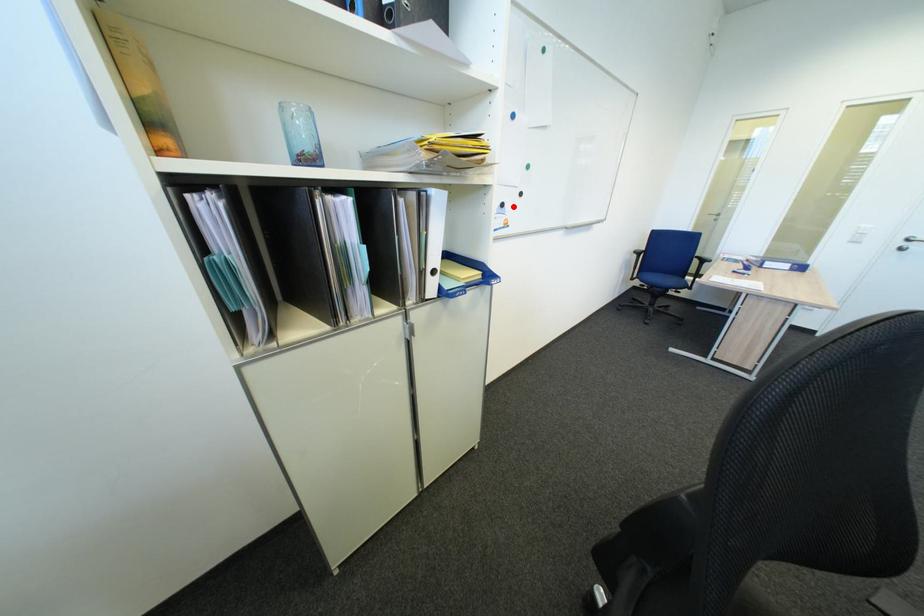
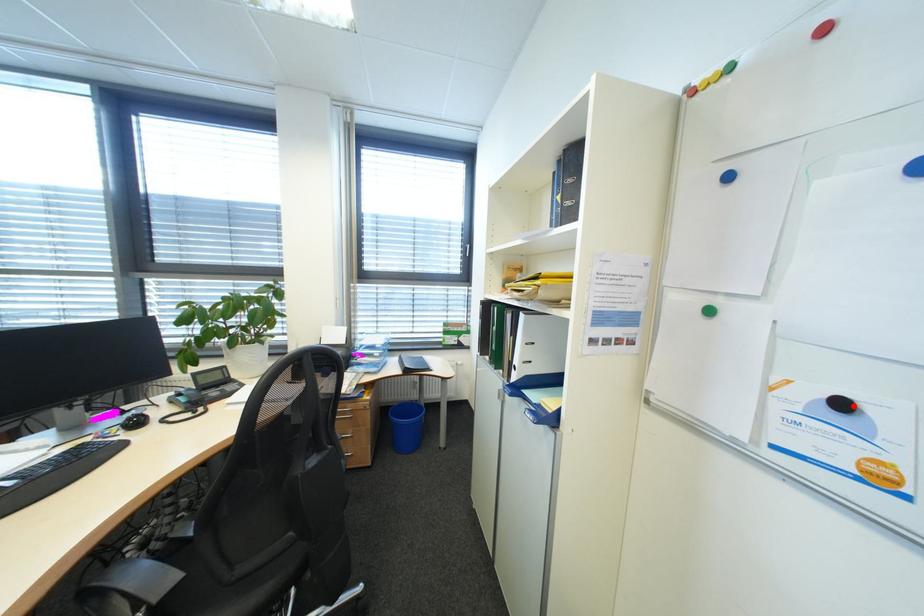
I am providing you with two images of the same scene from different viewpoints. A red point is marked on the first image and another point is marked on the second image. Are the points marked in image1 and image2 representing the same 3D position?

Yes